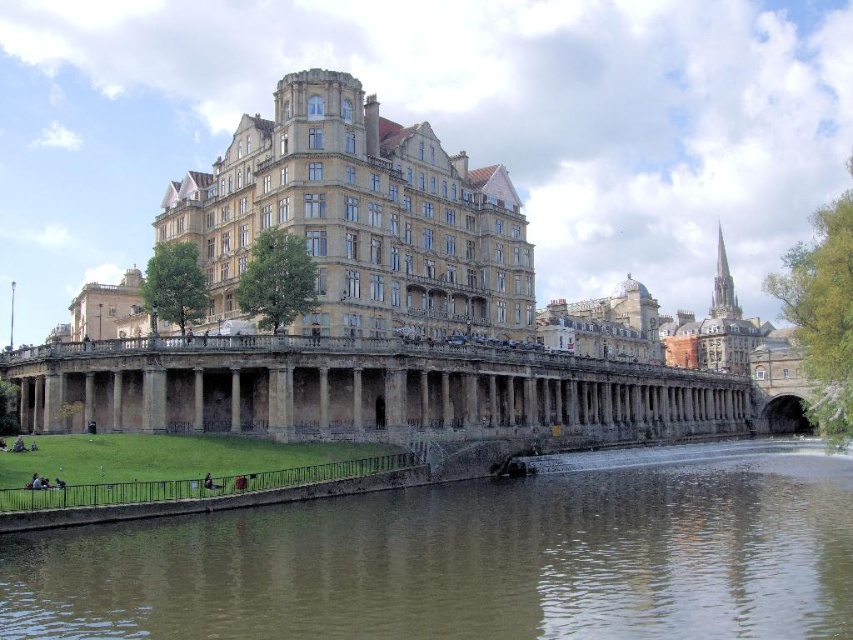
Who is positioned more to the left, brown murky water at lower center or stone columned bridge at center?

stone columned bridge at center is more to the left.

Does brown murky water at lower center have a lesser height compared to stone columned bridge at center?

Yes, brown murky water at lower center is shorter than stone columned bridge at center.

What are the coordinates of `brown murky water at lower center` in the screenshot? It's located at (476, 557).